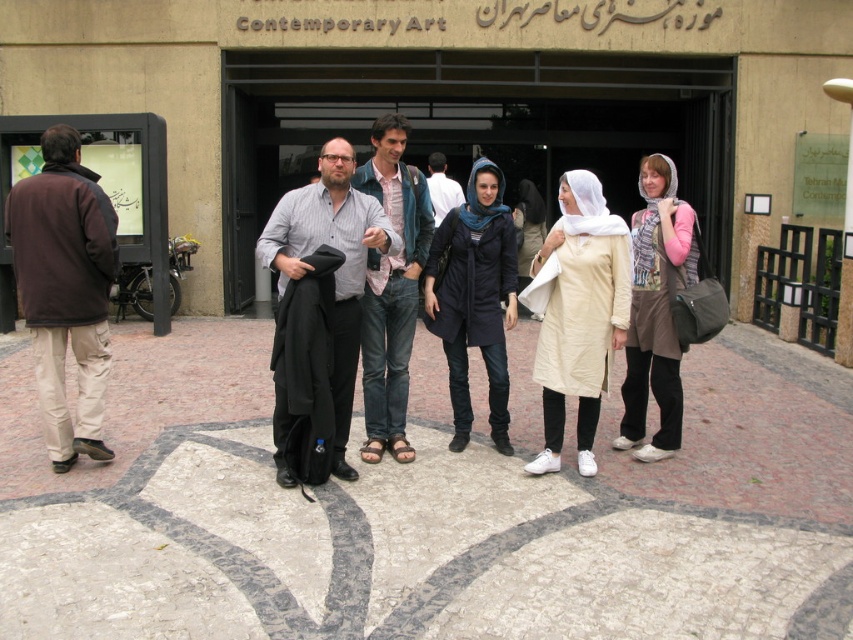
Question: Which of the following is the farthest from the observer?

Choices:
 (A) (44, 420)
 (B) (469, 196)

Answer: (B)

Question: Estimate the real-world distances between objects in this image. Which object is farther from the dark blue fabric hijab at center?

Choices:
 (A) light blue shirt at center
 (B) beige cotton dress at center
 (C) brown fleece jacket at left

Answer: (A)

Question: Does matte black jacket at center appear over dark blue fabric hijab at center?

Choices:
 (A) no
 (B) yes

Answer: (A)

Question: Estimate the real-world distances between objects in this image. Which object is farther from the light beige fabric dress at center?

Choices:
 (A) beige cotton dress at center
 (B) light beige fabric scarf at center

Answer: (A)

Question: Can you confirm if beige cotton dress at center is smaller than light blue shirt at center?

Choices:
 (A) yes
 (B) no

Answer: (B)

Question: Does matte black jacket at center come in front of denim jeans at center?

Choices:
 (A) yes
 (B) no

Answer: (A)